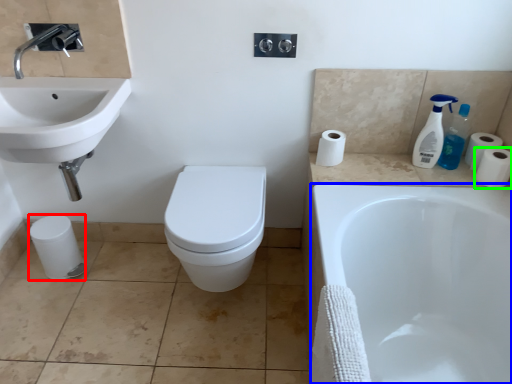
Question: Which object is the farthest from toilet paper (highlighted by a red box)? Choose among these: bathtub (highlighted by a blue box) or toilet paper (highlighted by a green box).

Choices:
 (A) bathtub
 (B) toilet paper

Answer: (B)